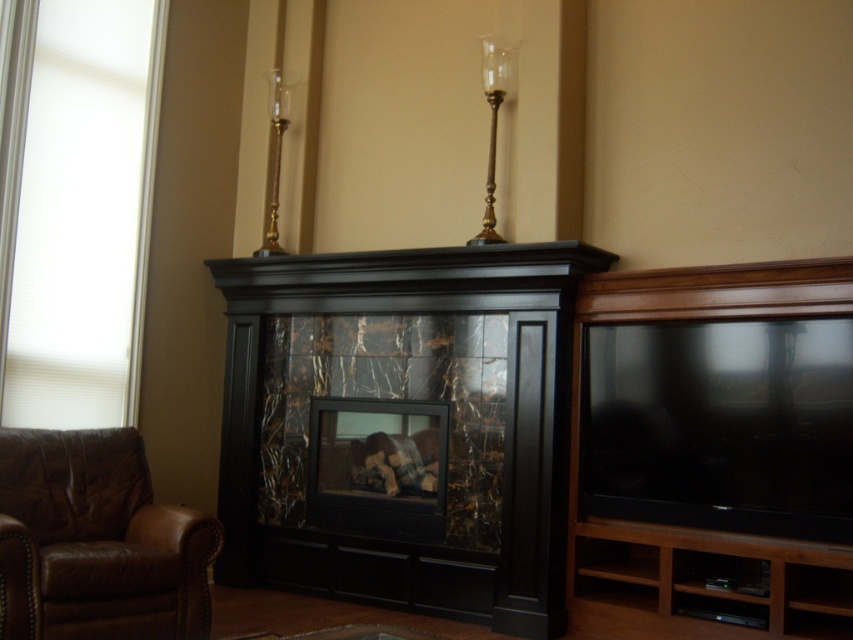
You are sitting on the brown leather armchair at lower left and want to watch TV on the black marble fireplace at center. Which direction should you turn your head to look at the fireplace?

You should turn your head to the right to look at the black marble fireplace at center because it is positioned to the right of your current position on the brown leather armchair at lower left.

You are standing in the living room corner near the fireplace. There are two points marked in the scene. The first point is at coordinate point (529, 360) and the second is at coordinate point (16, 461). From your perspective, which point is closer to you?

Point (16, 461) is closer to you because point (529, 360) is behind it.